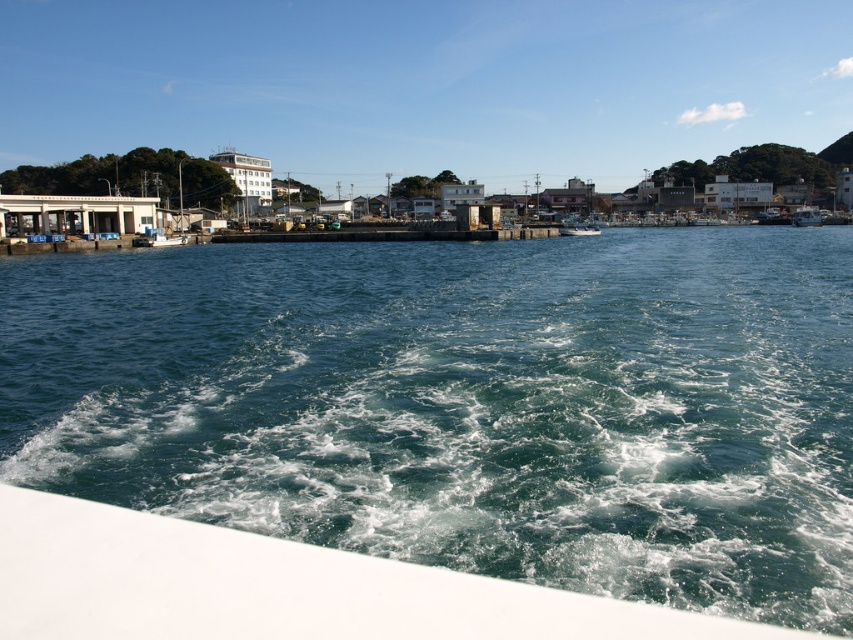
Question: Which object appears closest to the camera in this image?

Choices:
 (A) green water at center
 (B) white matte boat at lower left

Answer: (B)

Question: Is white matte boat at lower left wider than white plastic boat at right?

Choices:
 (A) yes
 (B) no

Answer: (B)

Question: Does green water at center have a larger size compared to white plastic boat at right?

Choices:
 (A) no
 (B) yes

Answer: (B)

Question: Can you confirm if green water at center is positioned above white plastic boat at right?

Choices:
 (A) no
 (B) yes

Answer: (A)

Question: Among these points, which one is nearest to the camera?

Choices:
 (A) (26, 589)
 (B) (314, 317)

Answer: (A)

Question: Which point is farther from the camera taking this photo?

Choices:
 (A) (599, 600)
 (B) (662, 378)

Answer: (B)